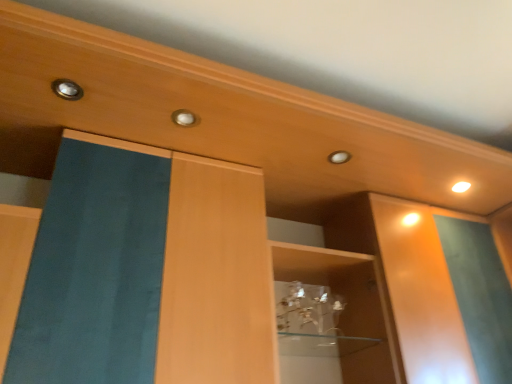
Question: Considering the relative sizes of matte metallic knob at upper left, the second knob when ordered from right to left, and white glossy light at upper right in the image provided, is matte metallic knob at upper left, the second knob when ordered from right to left, shorter than white glossy light at upper right?

Choices:
 (A) yes
 (B) no

Answer: (A)

Question: Does matte metallic knob at upper left, the 1th knob positioned from the top, appear on the right side of white glossy light at upper right?

Choices:
 (A) yes
 (B) no

Answer: (B)

Question: Is matte metallic knob at upper left, the second knob when ordered from right to left, beside white glossy light at upper right?

Choices:
 (A) no
 (B) yes

Answer: (A)

Question: Considering the relative positions of matte metallic knob at upper left, which ranks as the first knob in left-to-right order, and white glossy light at upper right in the image provided, is matte metallic knob at upper left, which ranks as the first knob in left-to-right order, to the left of white glossy light at upper right from the viewer's perspective?

Choices:
 (A) yes
 (B) no

Answer: (A)

Question: Is the depth of matte metallic knob at upper left, the second knob when ordered from right to left, greater than that of white glossy light at upper right?

Choices:
 (A) no
 (B) yes

Answer: (A)

Question: Can you confirm if matte gold knob at center, which appears as the 2th knob when viewed from the front, is thinner than white glossy light at upper right?

Choices:
 (A) no
 (B) yes

Answer: (A)

Question: Are matte gold knob at center, which appears as the 2th knob when viewed from the front, and white glossy light at upper right located far from each other?

Choices:
 (A) no
 (B) yes

Answer: (A)

Question: Would you say matte gold knob at center, which ranks as the first knob in bottom-to-top order, contains white glossy light at upper right?

Choices:
 (A) no
 (B) yes

Answer: (A)

Question: From the image's perspective, is matte gold knob at center, which appears as the 2th knob when viewed from the front, located beneath white glossy light at upper right?

Choices:
 (A) yes
 (B) no

Answer: (B)

Question: From the image's perspective, is matte gold knob at center, which is counted as the second knob, starting from the left, on top of white glossy light at upper right?

Choices:
 (A) yes
 (B) no

Answer: (A)

Question: Considering the relative positions of matte gold knob at center, which ranks as the first knob in bottom-to-top order, and white glossy light at upper right in the image provided, is matte gold knob at center, which ranks as the first knob in bottom-to-top order, to the left of white glossy light at upper right from the viewer's perspective?

Choices:
 (A) yes
 (B) no

Answer: (A)

Question: From a real-world perspective, does white glossy light at upper right sit lower than matte metallic knob at upper left, the 1th knob positioned from the top?

Choices:
 (A) yes
 (B) no

Answer: (A)